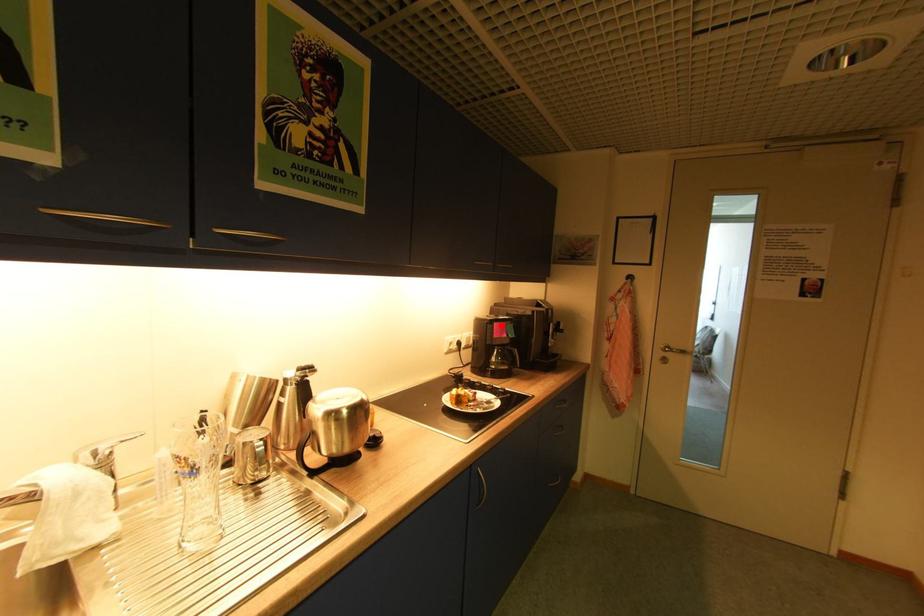
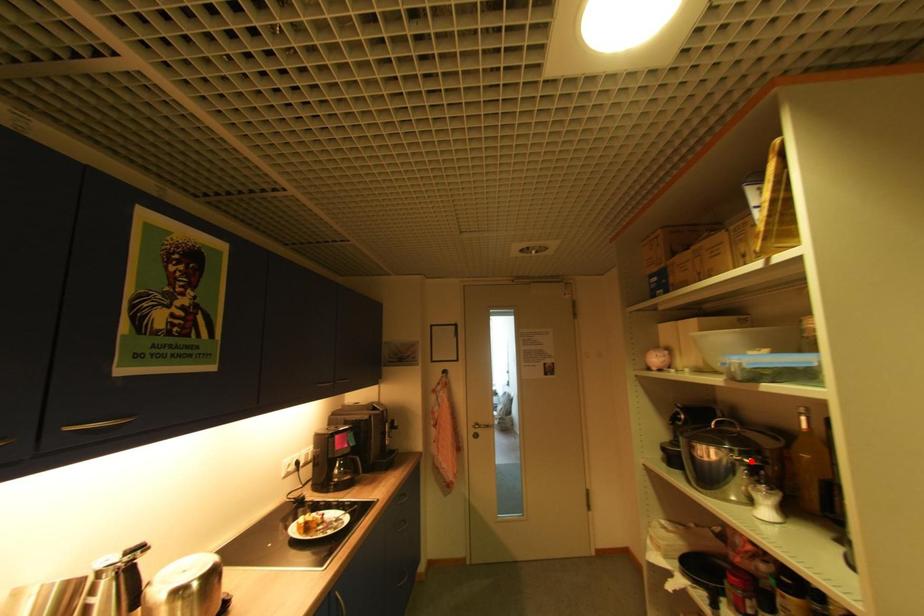
I am providing you with two images of the same scene from different viewpoints. A red point is marked on the first image and another point is marked on the second image. Is the red point in image1 aligned with the point shown in image2?

No